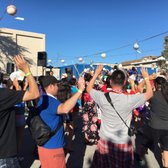
Identify the location of door. This screenshot has height=168, width=168. (10, 67).